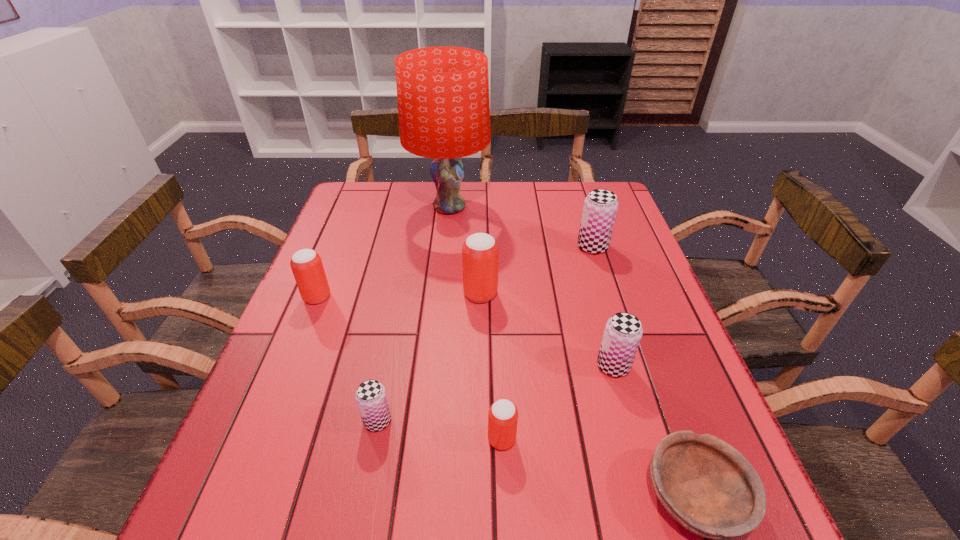
At what (x,y) coordinates should I click in order to perform the action: click on free space between the tallest object and the leftmost beer can. Please return your answer as a coordinate pair (x, y). Looking at the image, I should click on (383, 252).

At what (x,y) coordinates should I click in order to perform the action: click on free space that is in between the farthest beer can and the leftmost red beer can. Please return your answer as a coordinate pair (x, y). The height and width of the screenshot is (540, 960). Looking at the image, I should click on (455, 272).

Locate an element on the screen. free point between the nearest purple beer can and the biggest red beer can is located at coordinates (429, 357).

At what (x,y) coordinates should I click in order to perform the action: click on free space that is in between the leftmost object and the smallest purple beer can. Please return your answer as a coordinate pair (x, y). The height and width of the screenshot is (540, 960). Looking at the image, I should click on (348, 359).

This screenshot has width=960, height=540. I want to click on object that is the sixth closest to the second nearest purple beer can, so click(x=443, y=92).

Select which object appears as the second closest to the biggest red beer can. Please provide its 2D coordinates. Your answer should be formatted as a tuple, i.e. [(x, y)], where the tuple contains the x and y coordinates of a point satisfying the conditions above.

[(623, 332)]

Where is `the fifth closest beer can to the leftmost beer can`? the fifth closest beer can to the leftmost beer can is located at coordinates (600, 207).

Select which beer can is the fourth closest to the tallest object. Please provide its 2D coordinates. Your answer should be formatted as a tuple, i.e. [(x, y)], where the tuple contains the x and y coordinates of a point satisfying the conditions above.

[(623, 332)]

Locate which purple beer can ranks second in proximity to the second nearest purple beer can. Please provide its 2D coordinates. Your answer should be formatted as a tuple, i.e. [(x, y)], where the tuple contains the x and y coordinates of a point satisfying the conditions above.

[(371, 398)]

Point out which purple beer can is positioned as the third nearest to the shortest object. Please provide its 2D coordinates. Your answer should be formatted as a tuple, i.e. [(x, y)], where the tuple contains the x and y coordinates of a point satisfying the conditions above.

[(600, 207)]